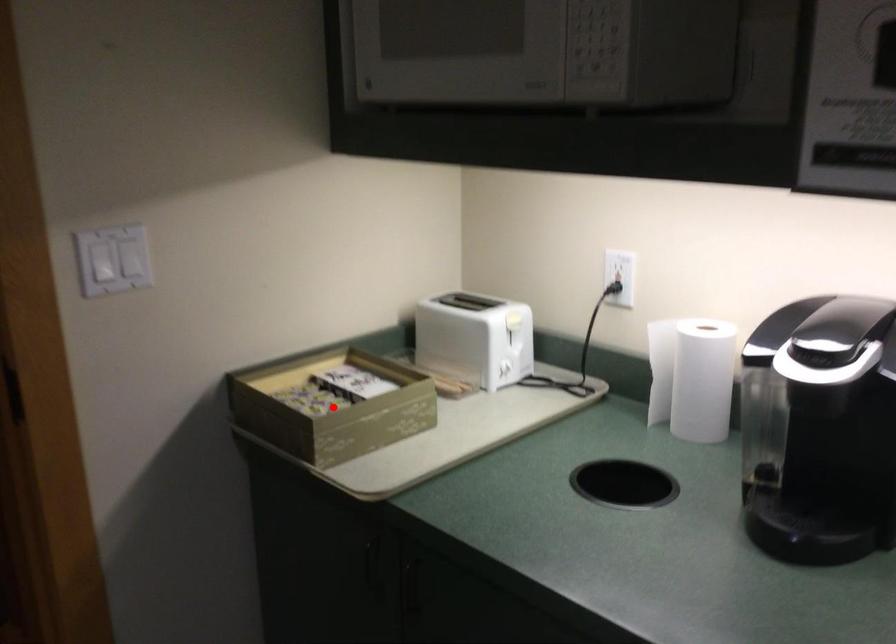
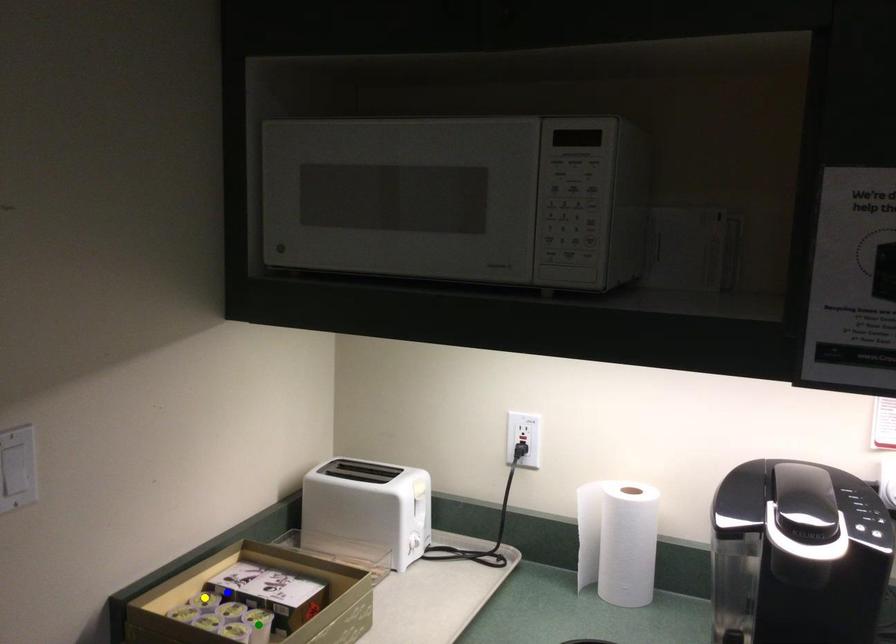
Question: I am providing you with two images of the same scene from different viewpoints. A red point is marked on the first image. You are given multiple points on the second image. Which spot in image 2 lines up with the point in image 1?

Choices:
 (A) blue point
 (B) yellow point
 (C) green point

Answer: (C)